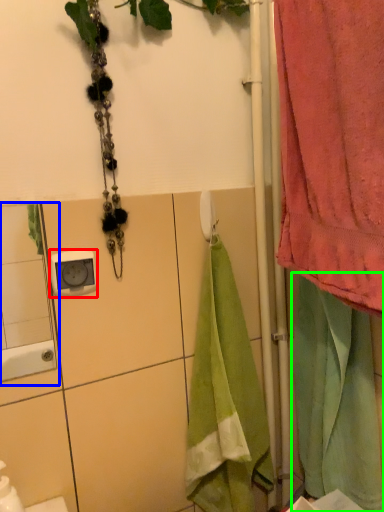
Question: Estimate the real-world distances between objects in this image. Which object is farther from electric outlet (highlighted by a red box), mirror (highlighted by a blue box) or beach towel (highlighted by a green box)?

Choices:
 (A) mirror
 (B) beach towel

Answer: (A)